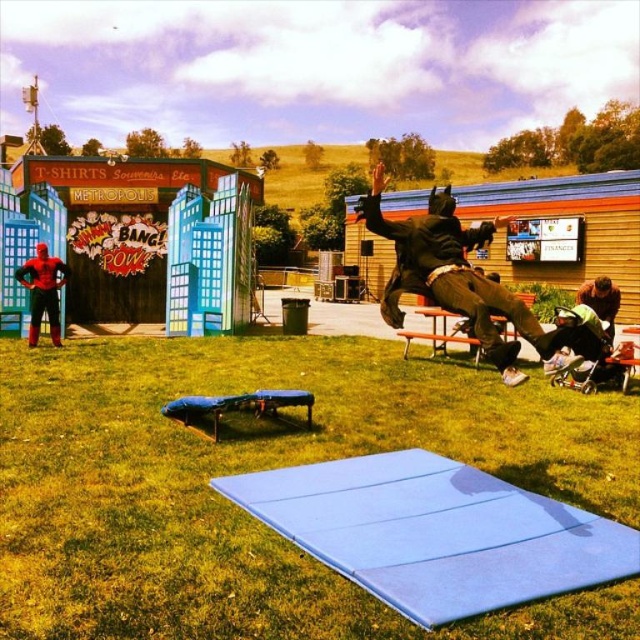
You are a photographer at the superhero event. You want to position a camera on the blue foam mat at center so that it can capture the dark brown leather jacket at upper center clearly. Is the jacket within the camera frame if the camera is pointed directly at the jacket?

The blue foam mat at center is to the left of the dark brown leather jacket at upper center, so positioning the camera on the mat and pointing it directly at the jacket should keep the jacket within the frame.

You are a photographer at the superhero event. You need to capture a photo where the blue foam mat at center and the shiny red suit at lower left are both visible. Which object will appear taller in the photo?

The shiny red suit at lower left will appear taller in the photo since it is taller than the blue foam mat at center according to the description.